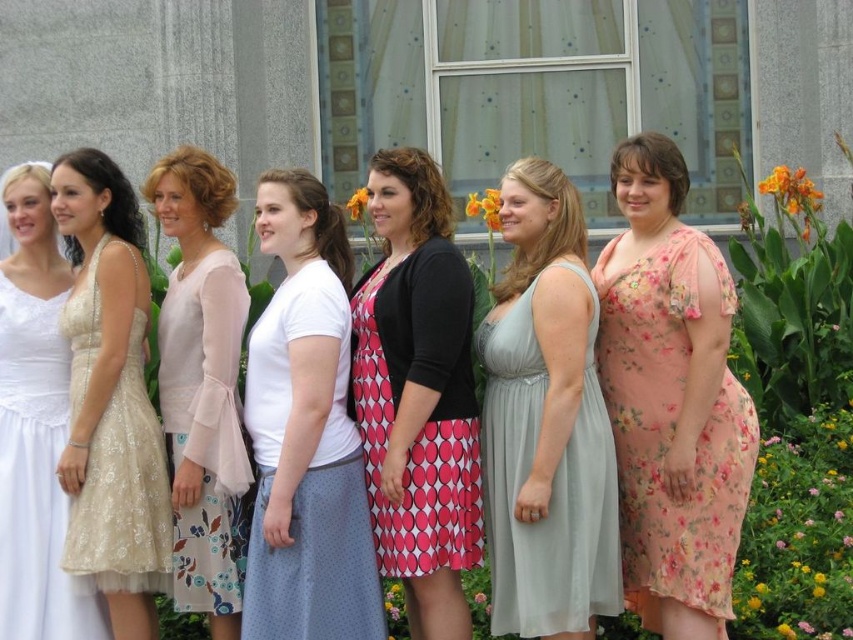
You are a photographer holding a camera. You want to take a photo of the sequined gold dress at center. Can you fit the entire dress into your camera frame without moving closer? The camera has a maximum zoom of 50 meters.

The sequined gold dress at center and camera are 38.30 meters apart from each other. Since the camera can zoom up to 50 meters, the photographer can fit the entire dress into the frame without moving closer.

You are a photographer trying to capture a detailed shot of both orange fabric flowers in the scene. Given their positions, can you fit both orange fabric flower at upper center and orange fabric flower at center into a single frame without moving either flower or the camera? Please explain your reasoning based on their distance apart.

The orange fabric flower at upper center and orange fabric flower at center are 19.90 meters apart. Since the distance between them is nearly 20 meters, it would be challenging to capture both in a single frame without moving the camera or the flowers. A standard camera lens might not have enough field of view to encompass such a large distance, so it would be difficult to fit both into one shot.

You are a photographer standing at the edge of the scene. You want to take a photo that includes both the sequined gold dress at center and the yellow fabric flower at center. Given that your camera has a maximum focus range of 15 meters, will you be able to capture both subjects clearly in the same frame?

The distance between the sequined gold dress at center and the yellow fabric flower at center is 17.92 meters, which exceeds the camera maximum focus range of 15 meters. Therefore, you cannot capture both subjects clearly in the same frame.